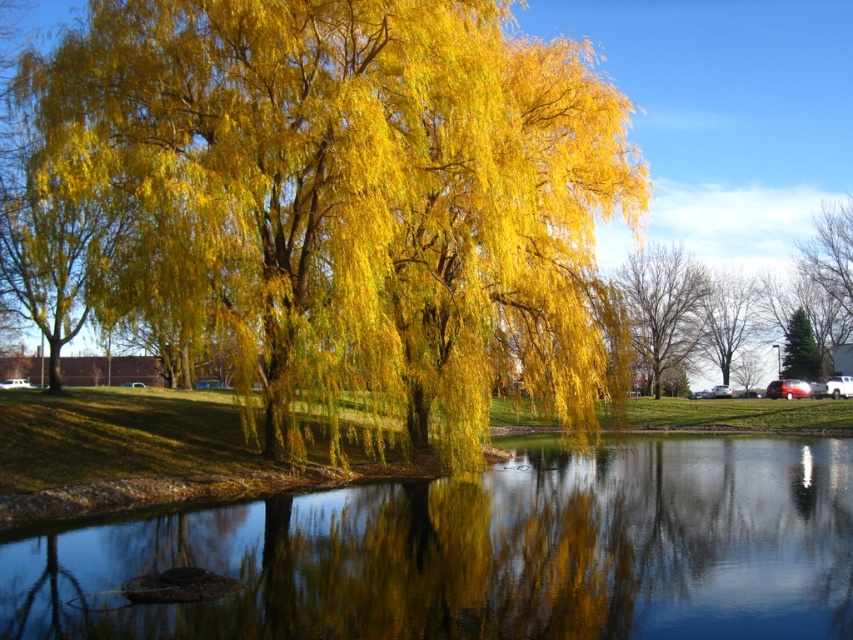
Question: From the image, what is the correct spatial relationship of golden yellow leaves at center in relation to smooth reflective water at center?

Choices:
 (A) right
 (B) left

Answer: (B)

Question: Which is farther from the smooth reflective water at center?

Choices:
 (A) smooth bark tree at center
 (B) bare branches tree at center
 (C) golden yellow leaves at center

Answer: (A)

Question: Which of the following is the farthest from the observer?

Choices:
 (A) (717, 358)
 (B) (643, 275)
 (C) (463, 408)
 (D) (222, 612)

Answer: (A)

Question: Is golden yellow leaves at center above bare branches tree at center?

Choices:
 (A) yes
 (B) no

Answer: (A)

Question: Which point is closer to the camera taking this photo?

Choices:
 (A) (125, 92)
 (B) (695, 291)

Answer: (A)

Question: Is golden yellow leaves at center to the right of smooth bark tree at center from the viewer's perspective?

Choices:
 (A) yes
 (B) no

Answer: (B)